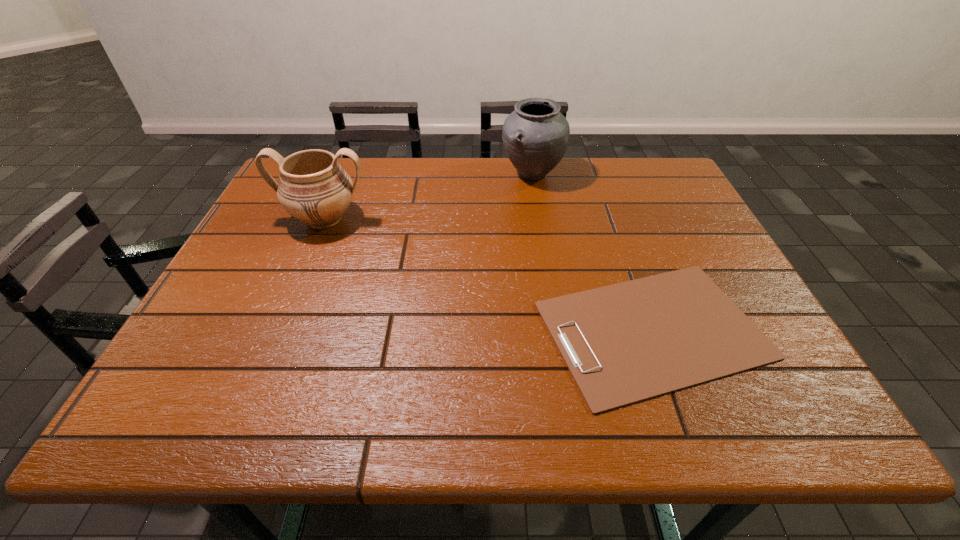
The image size is (960, 540). I want to click on the farther urn, so click(x=535, y=135).

You are a GUI agent. You are given a task and a screenshot of the screen. Output one action in this format:
    pyautogui.click(x=<x>, y=<y>)
    Task: Click on the farthest object
    
    Given the screenshot: What is the action you would take?
    pyautogui.click(x=535, y=135)

Where is `the nearer urn`? This screenshot has height=540, width=960. the nearer urn is located at coordinates (313, 187).

Identify the location of the leftmost object. The width and height of the screenshot is (960, 540). (313, 187).

Locate an element on the screen. the shortest object is located at coordinates (624, 343).

Where is `clipboard`? This screenshot has width=960, height=540. clipboard is located at coordinates (624, 343).

Where is `free location located on the left of the right urn`? free location located on the left of the right urn is located at coordinates (414, 174).

The height and width of the screenshot is (540, 960). I want to click on vacant space positioned 0.310m on the front-facing side of the leftmost object, so click(x=273, y=340).

Locate an element on the screen. The height and width of the screenshot is (540, 960). vacant region located on the left of the shortest object is located at coordinates (493, 330).

This screenshot has width=960, height=540. Find the location of `object situated at the near edge`. object situated at the near edge is located at coordinates (624, 343).